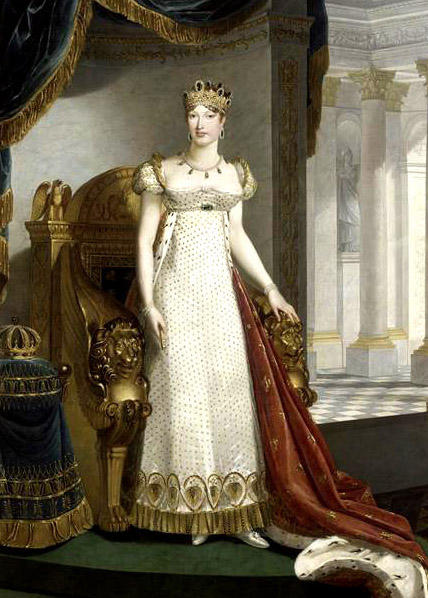
Locate an element on the screen. Image resolution: width=428 pixels, height=598 pixels. draped curtain is located at coordinates (35, 44).